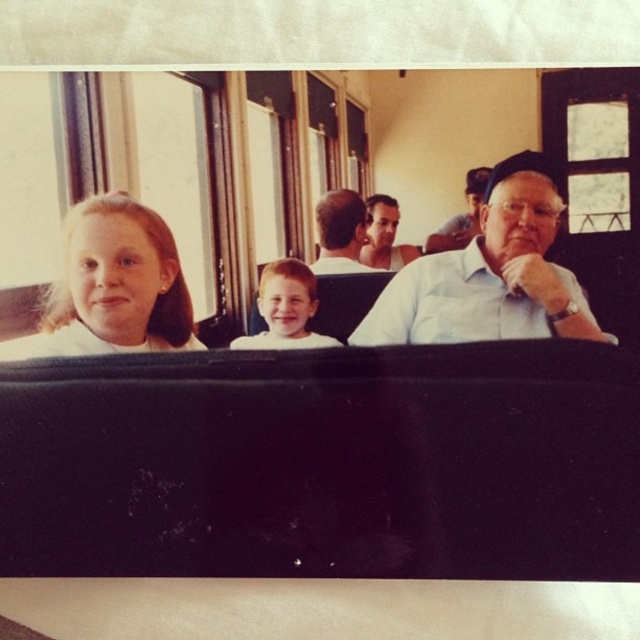
Is smooth blonde hair at center bigger than smooth brown hair at center?

Indeed, smooth blonde hair at center has a larger size compared to smooth brown hair at center.

In the scene shown: Does smooth blonde hair at center appear over smooth brown hair at center?

No.

Which is behind, point (262, 268) or point (332, 224)?

Positioned behind is point (262, 268).

The height and width of the screenshot is (640, 640). Identify the location of smooth blonde hair at center. (285, 308).

Describe the element at coordinates (113, 285) in the screenshot. The image size is (640, 640). I see `blonde hair at left` at that location.

Does blonde hair at left appear on the left side of smooth blonde hair at center?

Indeed, blonde hair at left is positioned on the left side of smooth blonde hair at center.

Who is more forward, (x=77, y=260) or (x=260, y=348)?

Point (x=77, y=260) is more forward.

The width and height of the screenshot is (640, 640). I want to click on blonde hair at left, so click(x=113, y=285).

In the scene shown: Who is more forward, (381, 301) or (339, 202)?

Point (339, 202)

Between light blue shirt at center and smooth brown hair at center, which one is positioned higher?

smooth brown hair at center

I want to click on light blue shirt at center, so click(490, 275).